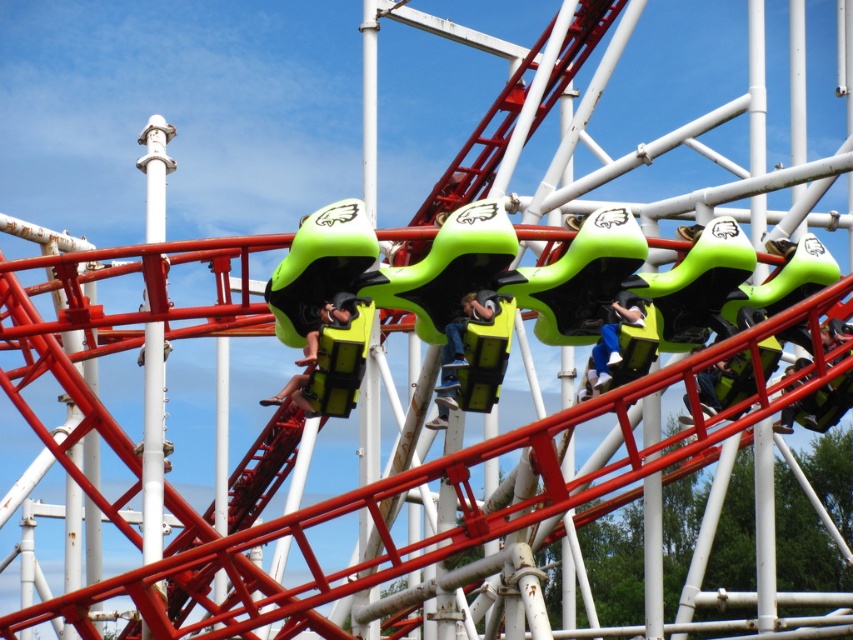
You are a photographer standing at the base of the roller coaster track. You notice two points marked on the track at coordinates point [776,275] and point [488,307]. Which point is closer to your camera?

Point [776,275] is further to the camera than point [488,307], so the point closer to the camera is point [488,307].

You are a photographer trying to capture a closeup of both the green matte seat at center and the light blue fabric pants at center in the amusement park image. Since you want both subjects to be clearly visible, which object should you adjust your camera focus to prioritize in terms of size?

The green matte seat at center is wider than the light blue fabric pants at center, so to ensure both are clearly visible, prioritize focusing on the green matte seat at center as it takes up more space in the frame.